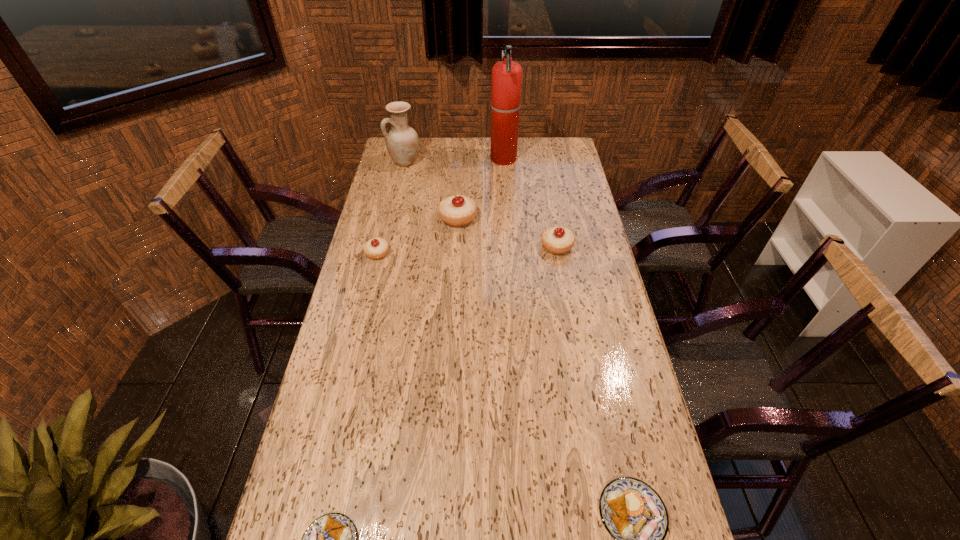
Where is `free space located with the nozzle and gauge on the fire extinguisher`? free space located with the nozzle and gauge on the fire extinguisher is located at coordinates (431, 159).

The width and height of the screenshot is (960, 540). Identify the location of free space located 0.240m with the nozzle and gauge on the fire extinguisher. (438, 159).

The width and height of the screenshot is (960, 540). What are the coordinates of `vacant point located 0.210m with the nozzle and gauge on the fire extinguisher` in the screenshot? It's located at click(x=444, y=159).

This screenshot has width=960, height=540. Identify the location of vacant space situated 0.300m on the right of the pink pottery. (487, 162).

Where is `free space located 0.360m on the front of the fourth object from left to right`? Image resolution: width=960 pixels, height=540 pixels. free space located 0.360m on the front of the fourth object from left to right is located at coordinates (453, 302).

Locate an element on the screen. free spot located 0.280m on the front of the second tallest pastry is located at coordinates (570, 319).

Locate an element on the screen. Image resolution: width=960 pixels, height=540 pixels. blank space located 0.070m on the right of the leftmost beige pastry is located at coordinates click(409, 253).

At what (x,y) coordinates should I click in order to perform the action: click on fire extinguisher situated at the far edge. Please return your answer as a coordinate pair (x, y). This screenshot has height=540, width=960. Looking at the image, I should click on (506, 75).

Find the location of a particular element. The width and height of the screenshot is (960, 540). pottery situated at the far edge is located at coordinates (402, 142).

At what (x,y) coordinates should I click in order to perform the action: click on pottery situated at the left edge. Please return your answer as a coordinate pair (x, y). This screenshot has height=540, width=960. Looking at the image, I should click on (402, 142).